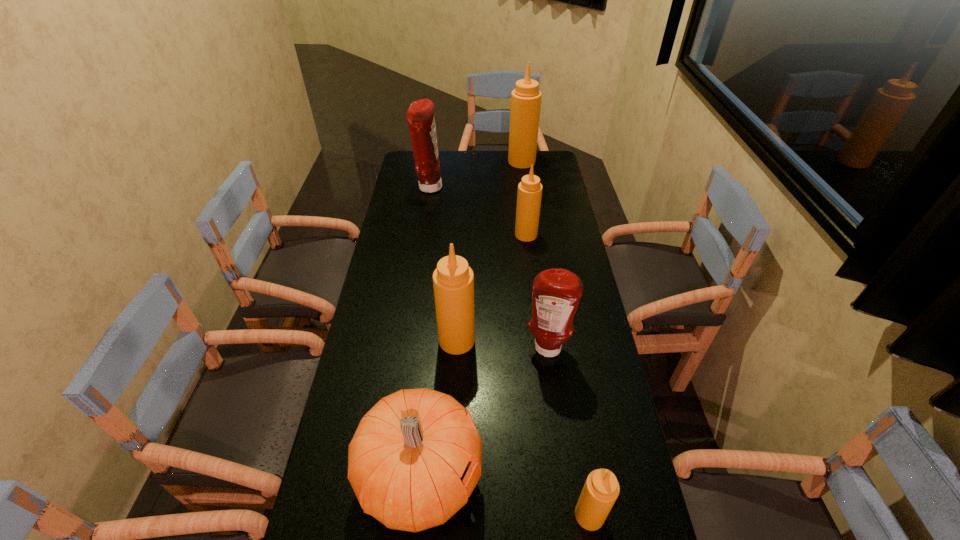
You are a GUI agent. You are given a task and a screenshot of the screen. Output one action in this format:
    pyautogui.click(x=<x>, y=<y>)
    Task: Click on the shortest object
    
    Given the screenshot: What is the action you would take?
    pyautogui.click(x=601, y=489)

Where is `the nearest condiment`? the nearest condiment is located at coordinates (601, 489).

Identify the location of free region located on the left of the farthest tan condiment. (481, 161).

Identify the location of free space located on the right of the fifth nearest condiment. (479, 187).

The height and width of the screenshot is (540, 960). Identify the location of free location located 0.160m on the left of the third smallest tan condiment. (386, 340).

Find the location of a particular element. The image size is (960, 540). free space located 0.140m on the right of the fourth nearest condiment is located at coordinates (574, 235).

Locate an element on the screen. This screenshot has height=540, width=960. free space located 0.190m on the front of the nearer red condiment is located at coordinates 558,423.

This screenshot has width=960, height=540. I want to click on vacant space located 0.300m on the left of the nearest condiment, so click(x=440, y=515).

You are a GUI agent. You are given a task and a screenshot of the screen. Output one action in this format:
    pyautogui.click(x=<x>, y=<y>)
    Task: Click on the object that is at the far edge
    The height and width of the screenshot is (540, 960).
    Given the screenshot: What is the action you would take?
    pyautogui.click(x=526, y=97)

The height and width of the screenshot is (540, 960). I want to click on object situated at the left edge, so click(420, 117).